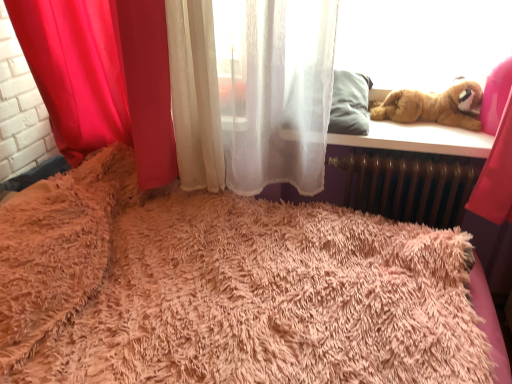
The height and width of the screenshot is (384, 512). What do you see at coordinates (433, 106) in the screenshot? I see `soft plush tiger at upper right` at bounding box center [433, 106].

What is the approximate width of soft plush tiger at upper right?

soft plush tiger at upper right is 7.70 inches in width.

In order to face soft plush tiger at upper right, should I rotate leftwards or rightwards?

Turn right approximately 21.979 degrees to face it.

Where is `soft plush tiger at upper right`? soft plush tiger at upper right is located at coordinates (433, 106).

Find the location of a particular element. Image resolution: width=512 pixels, height=384 pixels. soft plush tiger at upper right is located at coordinates (433, 106).